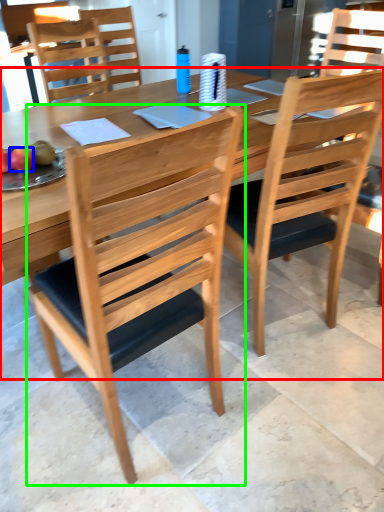
Question: Estimate the real-world distances between objects in this image. Which object is farther from table (highlighted by a red box), fruit (highlighted by a blue box) or chair (highlighted by a green box)?

Choices:
 (A) fruit
 (B) chair

Answer: (B)